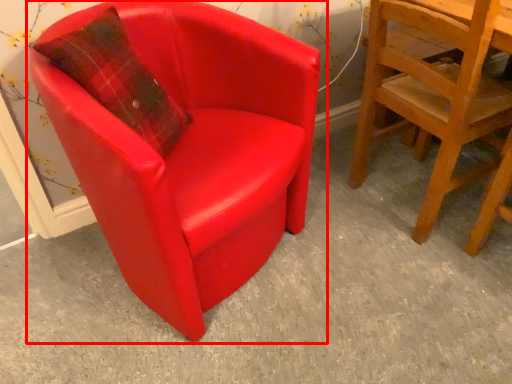
Question: Observing the image, what is the correct spatial positioning of chair (annotated by the red box) in reference to chair?

Choices:
 (A) left
 (B) right

Answer: (A)